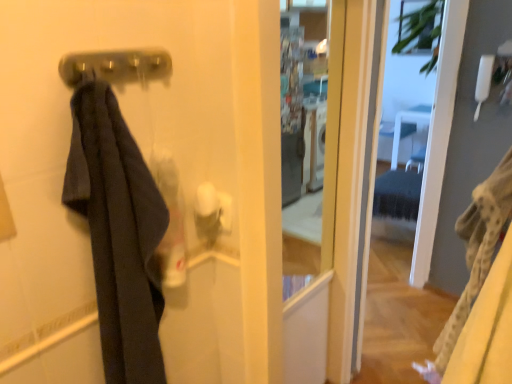
Question: Is dark fabric towel at left closer to the viewer compared to metallic silver door handle at upper center?

Choices:
 (A) yes
 (B) no

Answer: (A)

Question: Does dark fabric towel at left have a greater width compared to metallic silver door handle at upper center?

Choices:
 (A) no
 (B) yes

Answer: (B)

Question: Is dark fabric towel at left at the right side of metallic silver door handle at upper center?

Choices:
 (A) yes
 (B) no

Answer: (A)

Question: Does dark fabric towel at left appear on the left side of metallic silver door handle at upper center?

Choices:
 (A) yes
 (B) no

Answer: (B)

Question: Considering the relative sizes of dark fabric towel at left and metallic silver door handle at upper center in the image provided, is dark fabric towel at left thinner than metallic silver door handle at upper center?

Choices:
 (A) yes
 (B) no

Answer: (B)

Question: Is dark fabric towel at left aimed at metallic silver door handle at upper center?

Choices:
 (A) no
 (B) yes

Answer: (A)

Question: Is dark fabric towel at left completely or partially outside of transparent glass screen door at center?

Choices:
 (A) no
 (B) yes

Answer: (B)

Question: Is dark fabric towel at left at the right side of transparent glass screen door at center?

Choices:
 (A) yes
 (B) no

Answer: (B)

Question: Is dark fabric towel at left thinner than transparent glass screen door at center?

Choices:
 (A) yes
 (B) no

Answer: (A)

Question: From a real-world perspective, does dark fabric towel at left stand above transparent glass screen door at center?

Choices:
 (A) yes
 (B) no

Answer: (A)

Question: From the image's perspective, is dark fabric towel at left on top of transparent glass screen door at center?

Choices:
 (A) yes
 (B) no

Answer: (B)

Question: Can you confirm if dark fabric towel at left is shorter than transparent glass screen door at center?

Choices:
 (A) yes
 (B) no

Answer: (A)

Question: Would you consider transparent glass screen door at center to be distant from metallic silver door handle at upper center?

Choices:
 (A) yes
 (B) no

Answer: (A)